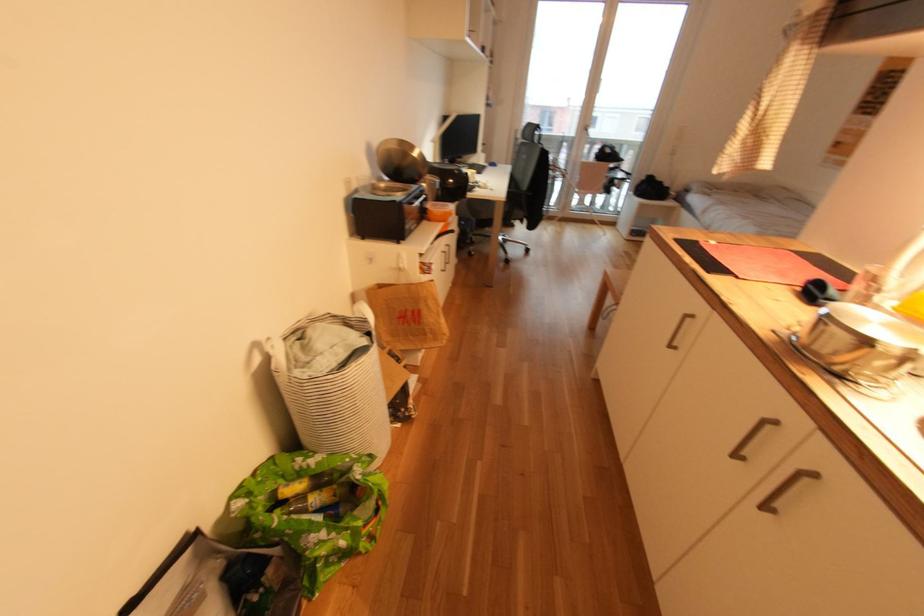
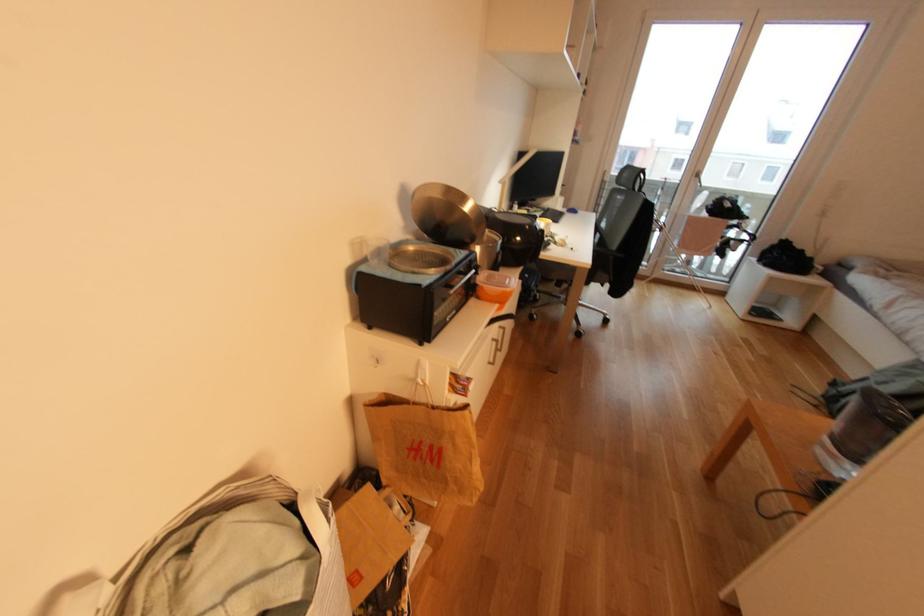
Question: The camera is either moving clockwise (left) or counter-clockwise (right) around the object. The first image is from the beginning of the video and the second image is from the end. Is the camera moving left or right when shooting the video?

Choices:
 (A) Left
 (B) Right

Answer: (B)